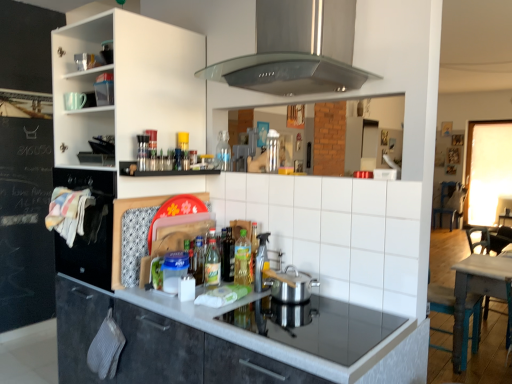
Find the location of `free spot above dark gray laminate cabinet at center (from a real-world perspective)`. free spot above dark gray laminate cabinet at center (from a real-world perspective) is located at coordinates (228, 300).